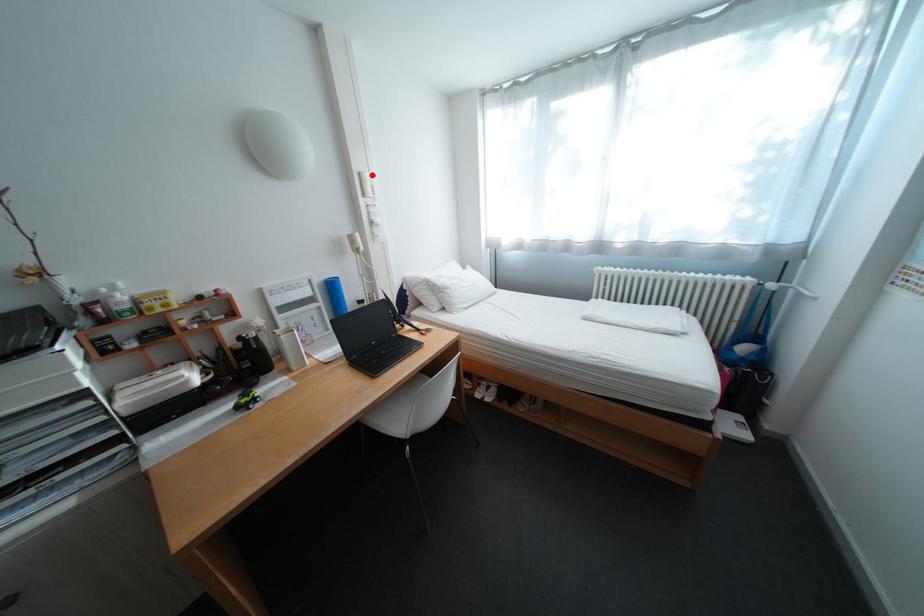
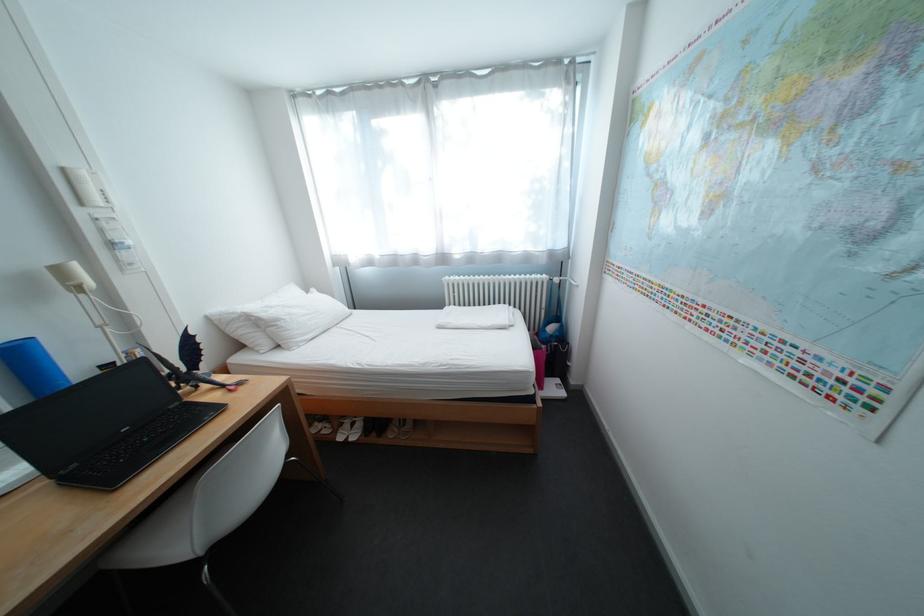
The point at the highlighted location is marked in the first image. Where is the corresponding point in the second image?

(76, 171)